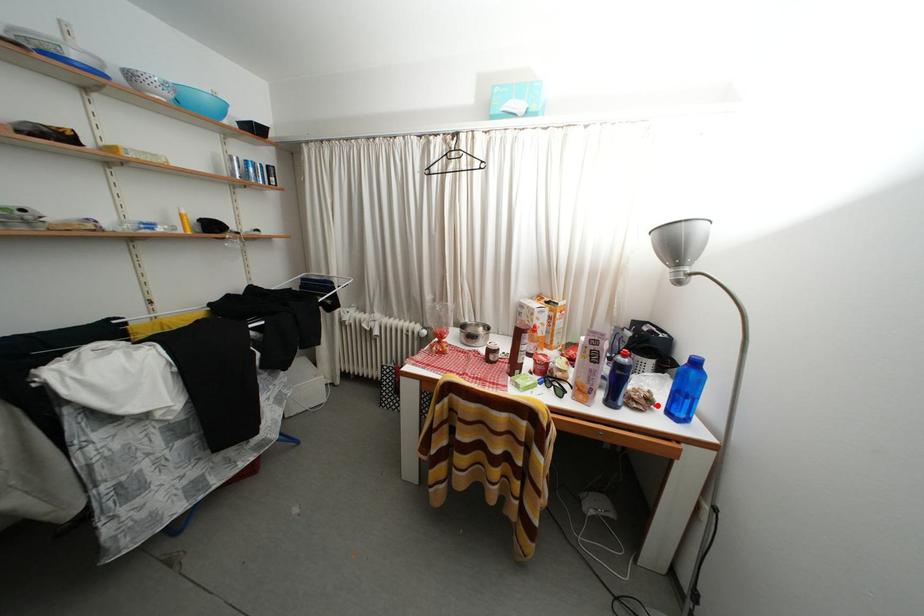
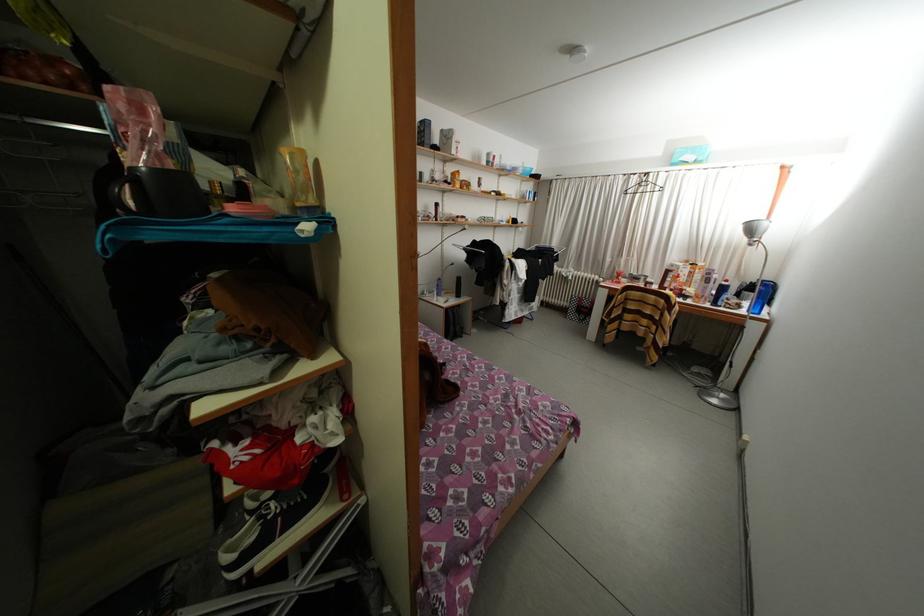
Question: I am providing you with two images of the same scene from different viewpoints. A red point is marked on the first image. Is the red point's position out of view in image 2?

Choices:
 (A) Yes
 (B) No

Answer: (B)